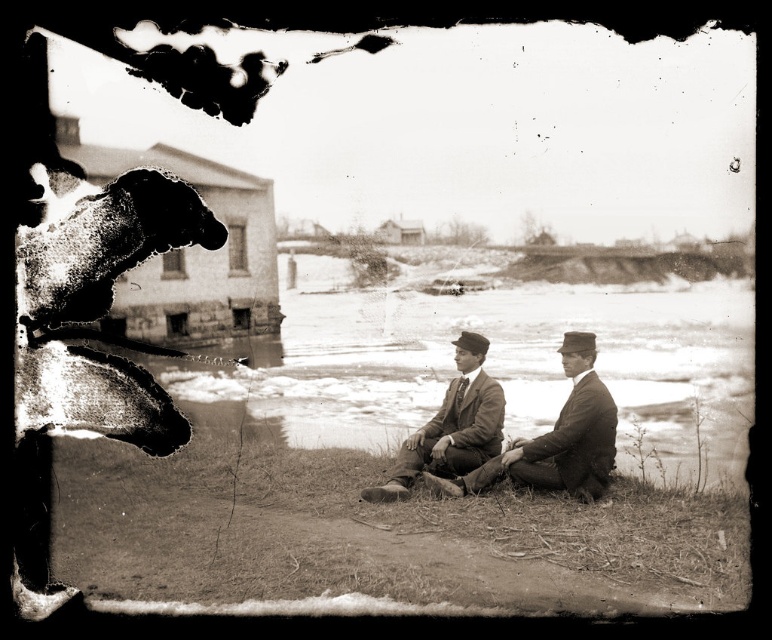
You are a photographer analyzing this vintage image. You notice the smooth stone wall at left and the smooth brown suit at center. Which object is located to the left of the other?

The smooth stone wall at left is positioned on the left side of the smooth brown suit at center.

You are a photographer trying to locate the smooth brown suit at center in this vintage image. According to the coordinates provided, where exactly would you find it?

The smooth brown suit at center is located at coordinates point (557,438).